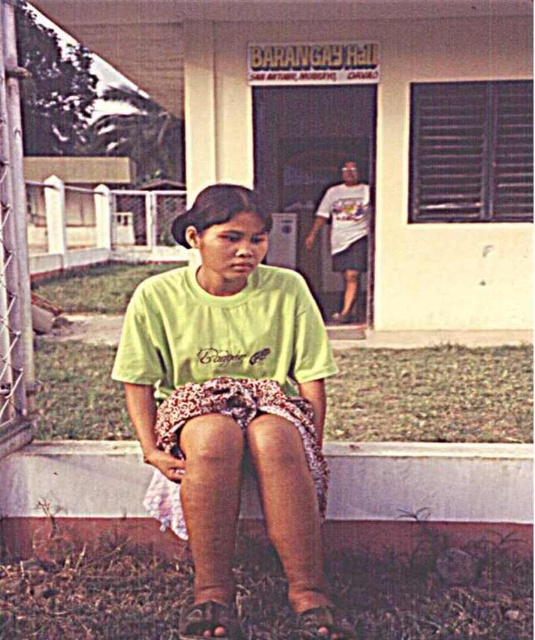
Question: Which of the following is the farthest from the observer?

Choices:
 (A) (294, 449)
 (B) (135, 515)

Answer: (B)

Question: Which point is closer to the camera?

Choices:
 (A) green matte shirt at center
 (B) brown concrete curb at lower center

Answer: (A)

Question: In this image, where is green matte shirt at center located relative to brown concrete curb at lower center?

Choices:
 (A) right
 (B) left

Answer: (B)

Question: Does green matte shirt at center have a lesser width compared to brown concrete curb at lower center?

Choices:
 (A) no
 (B) yes

Answer: (B)

Question: Which point is closer to the camera taking this photo?

Choices:
 (A) (281, 552)
 (B) (351, 465)

Answer: (A)

Question: Is green matte shirt at center above brown concrete curb at lower center?

Choices:
 (A) no
 (B) yes

Answer: (B)